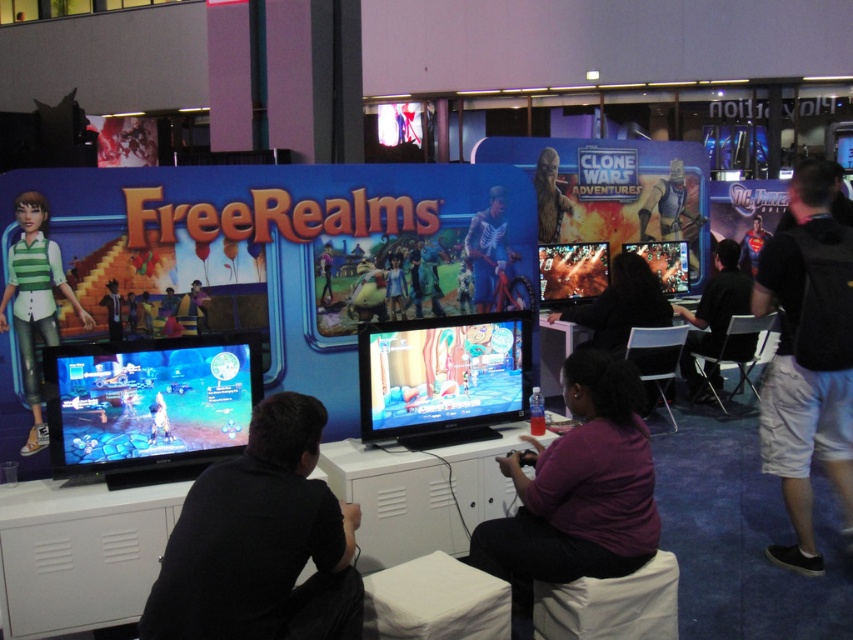
Can you confirm if black matte shirt at center is shorter than shiny metallic figure at center?

Indeed, black matte shirt at center has a lesser height compared to shiny metallic figure at center.

Between point (218, 579) and point (540, 173), which one is positioned behind?

The point (540, 173) is behind.

Where is `black matte shirt at center`? black matte shirt at center is located at coordinates (260, 541).

Can you confirm if black fabric backpack at right is smaller than shiny blue screen at left?

No, black fabric backpack at right is not smaller than shiny blue screen at left.

Does black fabric backpack at right appear on the right side of shiny blue screen at left?

Correct, you'll find black fabric backpack at right to the right of shiny blue screen at left.

What do you see at coordinates (805, 362) in the screenshot? Image resolution: width=853 pixels, height=640 pixels. I see `black fabric backpack at right` at bounding box center [805, 362].

Where is `black fabric backpack at right`? black fabric backpack at right is located at coordinates (805, 362).

Looking at this image, which of these two, dark gray shirt at right or shiny metallic figure at center, stands taller?

dark gray shirt at right

Who is positioned more to the left, dark gray shirt at right or shiny metallic figure at center?

Positioned to the left is shiny metallic figure at center.

The image size is (853, 640). What do you see at coordinates (714, 317) in the screenshot? I see `dark gray shirt at right` at bounding box center [714, 317].

Find the location of a particular element. The image size is (853, 640). dark gray shirt at right is located at coordinates (714, 317).